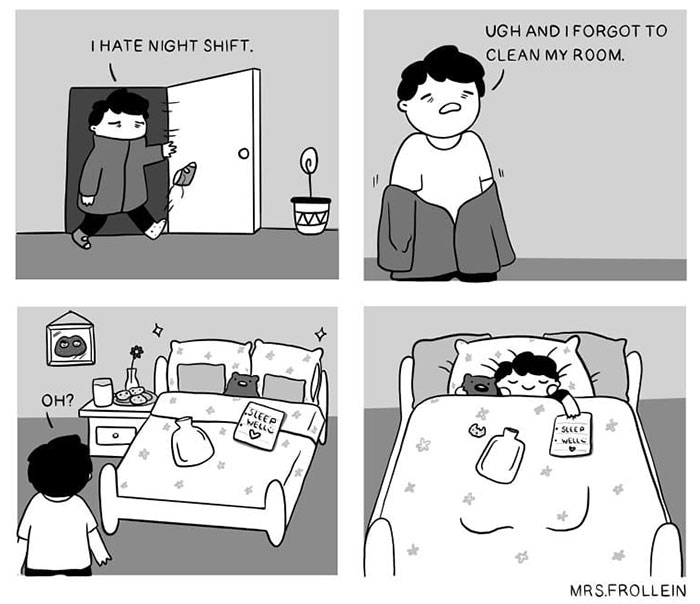
Find the location of a particular element. The image size is (700, 604). pillows is located at coordinates (442, 356), (484, 353), (595, 342), (294, 358), (292, 381), (194, 373), (197, 345).